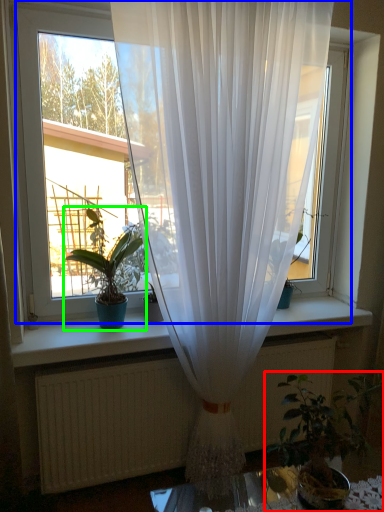
Question: Which is farther away from houseplant (highlighted by a red box)? window (highlighted by a blue box) or houseplant (highlighted by a green box)?

Choices:
 (A) window
 (B) houseplant

Answer: (A)